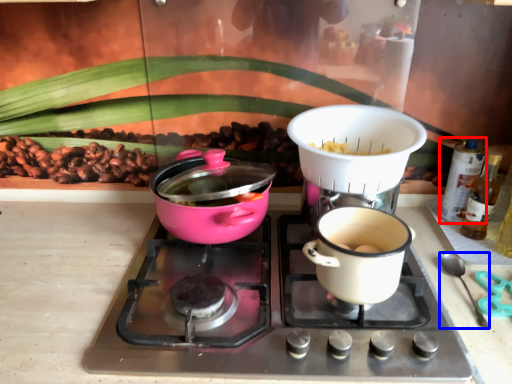
Question: Which of the following is the closest to the observer, bottle (highlighted by a red box) or silverware (highlighted by a blue box)?

Choices:
 (A) bottle
 (B) silverware

Answer: (B)